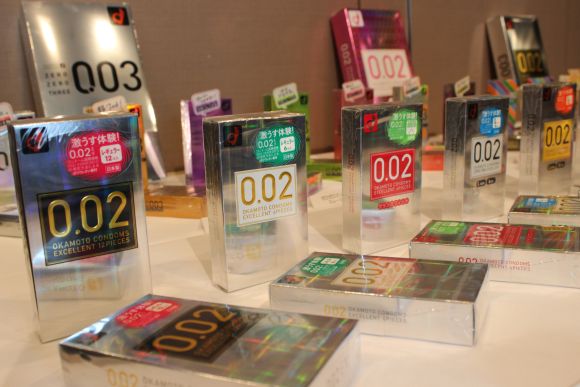
This screenshot has width=580, height=387. Identify the location of display units. (78, 56), (372, 30), (525, 30).